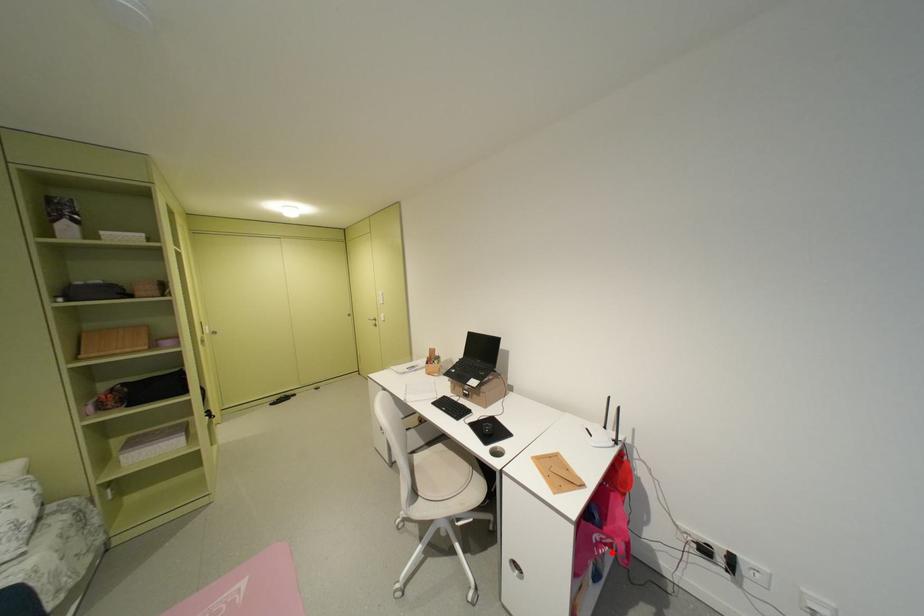
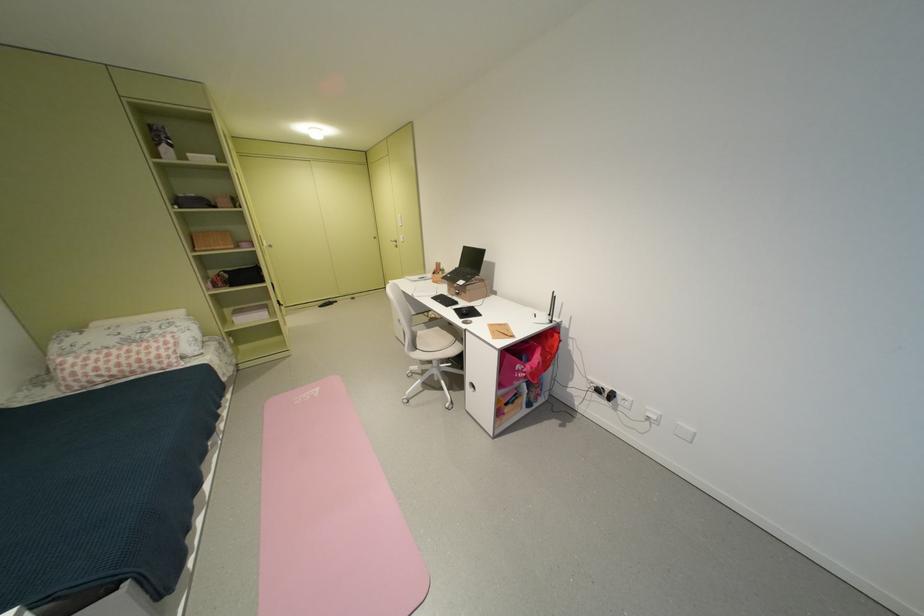
Question: A red point is marked in image1. In image2, is the corresponding 3D point closer to the camera or farther? Reply with the corresponding letter.

Choices:
 (A) The corresponding 3D point is closer.
 (B) The corresponding 3D point is farther.

Answer: (B)